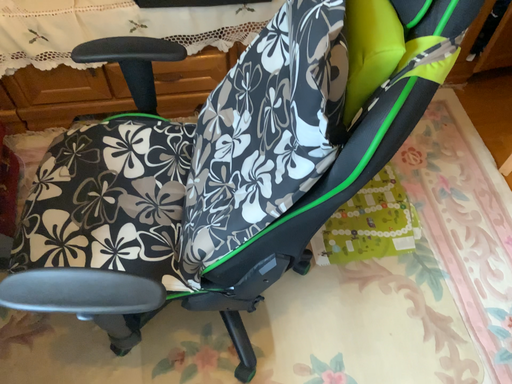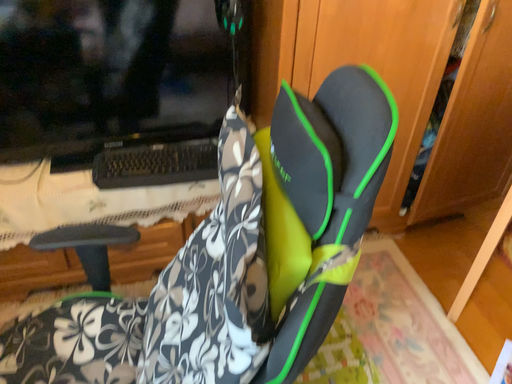
Question: How did the camera likely rotate when shooting the video?

Choices:
 (A) rotated downward
 (B) rotated upward

Answer: (B)